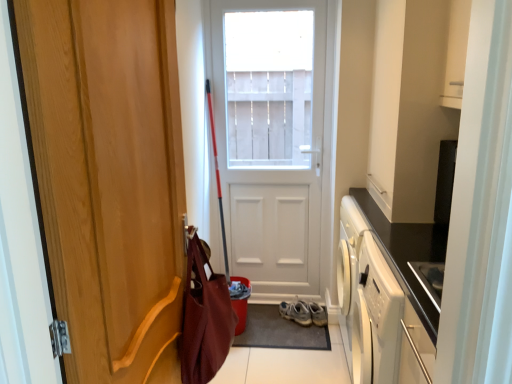
Where is `vacant area that is in front of dark gray rubber doormat at center`? The height and width of the screenshot is (384, 512). vacant area that is in front of dark gray rubber doormat at center is located at coordinates (289, 363).